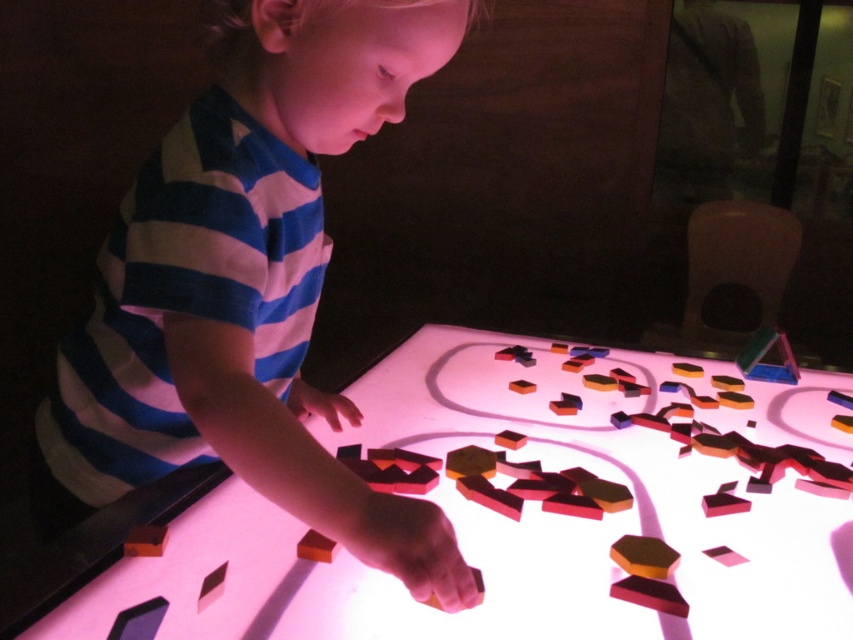
The child is trying to stack the rubberized plastic block at lower left and the rubber cube at lower center. Which block should they place at the bottom to ensure stability?

The rubber cube at lower center should be placed at the bottom because it is taller than the rubberized plastic block at lower left, providing a more stable base.